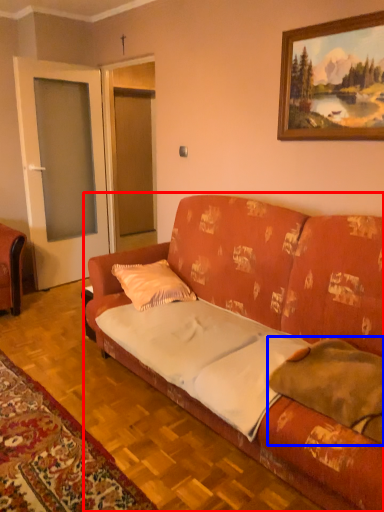
Question: Which point is closer to the camera, studio couch (highlighted by a red box) or pillow (highlighted by a blue box)?

Choices:
 (A) studio couch
 (B) pillow

Answer: (A)